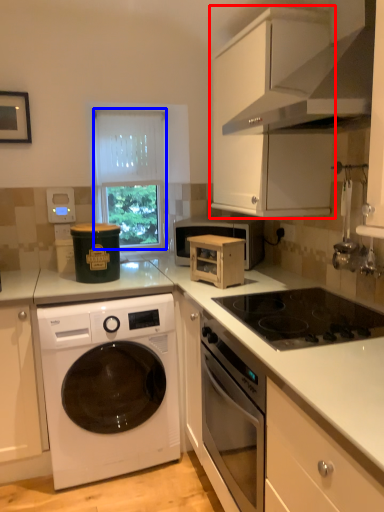
Question: Among these objects, which one is farthest to the camera, cabinetry (highlighted by a red box) or window (highlighted by a blue box)?

Choices:
 (A) cabinetry
 (B) window

Answer: (B)